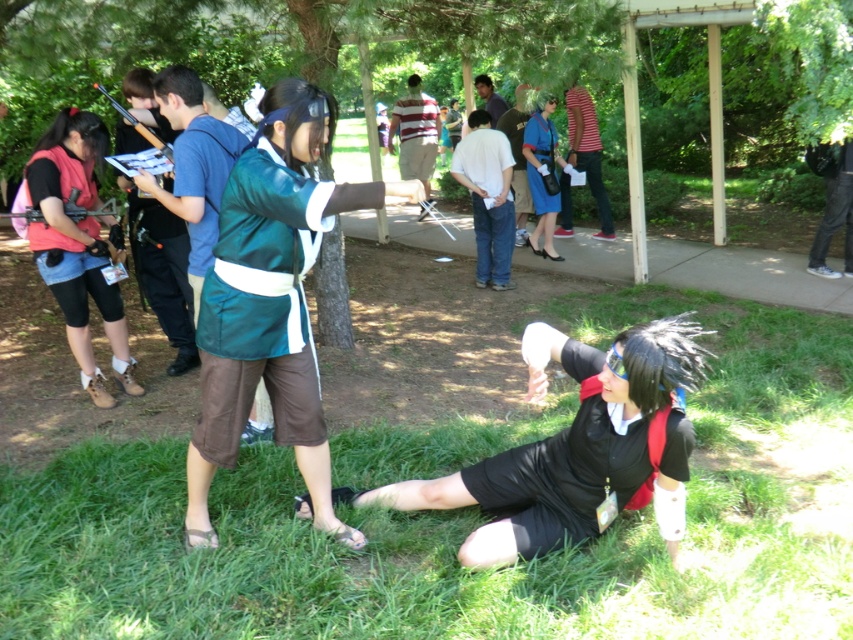
Does striped cotton shirt at upper center have a smaller size compared to denim jeans at center?

Incorrect, striped cotton shirt at upper center is not smaller in size than denim jeans at center.

Is point (564, 232) positioned before point (515, 195)?

That is False.

Locate an element on the screen. This screenshot has width=853, height=640. striped cotton shirt at upper center is located at coordinates (587, 150).

Is matte blue dress at center to the right of dark blue shirt at center from the viewer's perspective?

Correct, you'll find matte blue dress at center to the right of dark blue shirt at center.

The image size is (853, 640). What do you see at coordinates (543, 176) in the screenshot? I see `matte blue dress at center` at bounding box center [543, 176].

Between point (543, 154) and point (502, 102), which one is positioned in front?

Point (543, 154)

I want to click on matte blue dress at center, so click(x=543, y=176).

Does green grass at lower center appear over black matte dress at lower center?

Incorrect, green grass at lower center is not positioned above black matte dress at lower center.

Is green grass at lower center positioned behind black matte dress at lower center?

That is False.

Find the location of a particular element. This screenshot has height=640, width=853. green grass at lower center is located at coordinates (465, 524).